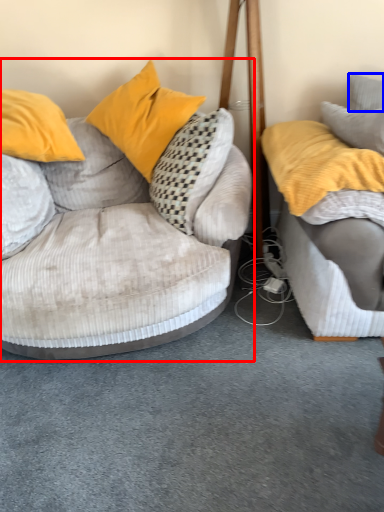
Question: Which of the following is the farthest to the observer, studio couch (highlighted by a red box) or pillow (highlighted by a blue box)?

Choices:
 (A) studio couch
 (B) pillow

Answer: (B)